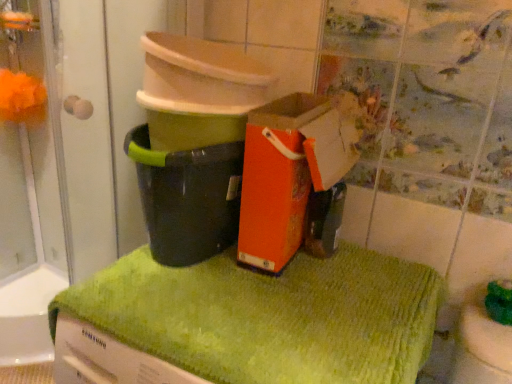
Image resolution: width=512 pixels, height=384 pixels. Identify the location of black plastic bucket at center. (187, 198).

Identify the location of orange paper bag at center. (290, 177).

This screenshot has width=512, height=384. Describe the element at coordinates (22, 98) in the screenshot. I see `orange fuzzy ball at upper left` at that location.

Where is `black plastic bucket at center`? The height and width of the screenshot is (384, 512). black plastic bucket at center is located at coordinates (187, 198).

Is green textured bath towel at center taller or shorter than orange paper bag at center?

In the image, green textured bath towel at center appears to be shorter than orange paper bag at center.

From a real-world perspective, is green textured bath towel at center physically above orange paper bag at center?

No.

Which is farther from the camera, (214, 264) or (331, 187)?

Positioned behind is point (214, 264).

Which object is closer to the camera, green textured bath towel at center or orange paper bag at center?

green textured bath towel at center is closer to the camera.

From their relative heights in the image, would you say orange paper bag at center is taller or shorter than green textured bath towel at center?

In the image, orange paper bag at center appears to be taller than green textured bath towel at center.

In the scene shown: Is orange paper bag at center facing away from green textured bath towel at center?

No.

From a real-world perspective, is orange paper bag at center beneath green textured bath towel at center?

Actually, orange paper bag at center is physically above green textured bath towel at center in the real world.

Which object is positioned more to the right, orange paper bag at center or green textured bath towel at center?

Positioned to the right is orange paper bag at center.

Does orange fuzzy ball at upper left have a greater width compared to black plastic bucket at center?

In fact, orange fuzzy ball at upper left might be narrower than black plastic bucket at center.

Is orange fuzzy ball at upper left surrounding black plastic bucket at center?

No, black plastic bucket at center is located outside of orange fuzzy ball at upper left.

Does orange fuzzy ball at upper left turn towards black plastic bucket at center?

No.

Based on their sizes in the image, would you say orange fuzzy ball at upper left is bigger or smaller than black plastic bucket at center?

Considering their sizes, orange fuzzy ball at upper left takes up less space than black plastic bucket at center.

From the picture: From a real-world perspective, who is located higher, orange fuzzy ball at upper left or green textured bath towel at center?

Answer: From a 3D spatial view, orange fuzzy ball at upper left is above.

Who is shorter, orange fuzzy ball at upper left or green textured bath towel at center?

Standing shorter between the two is orange fuzzy ball at upper left.

From the image's perspective, between orange fuzzy ball at upper left and green textured bath towel at center, who is located below?

green textured bath towel at center, from the image's perspective.

Does orange fuzzy ball at upper left touch green textured bath towel at center?

No.

From the image's perspective, between green textured bath towel at center and black plastic bucket at center, who is located below?

green textured bath towel at center.

Which of these two, green textured bath towel at center or black plastic bucket at center, is smaller?

Smaller between the two is black plastic bucket at center.

Locate an element on the screen. This screenshot has width=512, height=384. waste container above the green textured bath towel at center (from a real-world perspective) is located at coordinates (187, 198).

Can you confirm if black plastic bucket at center is positioned to the left of orange paper bag at center?

Yes.

From the image's perspective, is black plastic bucket at center located beneath orange paper bag at center?

Yes, from the image's perspective, black plastic bucket at center is below orange paper bag at center.

Is black plastic bucket at center oriented away from orange paper bag at center?

No, black plastic bucket at center is not facing the opposite direction of orange paper bag at center.

Does black plastic bucket at center have a greater height compared to orange paper bag at center?

Incorrect, the height of black plastic bucket at center is not larger of that of orange paper bag at center.

Is black plastic bucket at center thinner than green textured bath towel at center?

Yes, black plastic bucket at center is thinner than green textured bath towel at center.

What's the angular difference between black plastic bucket at center and green textured bath towel at center's facing directions?

The angular difference between black plastic bucket at center and green textured bath towel at center is 5.88 degrees.

Which of these two, black plastic bucket at center or green textured bath towel at center, is smaller?

black plastic bucket at center is smaller.

From a real-world perspective, which object stands above the other?

black plastic bucket at center, from a real-world perspective.

Find the location of a particular element. cardboard box above the green textured bath towel at center (from the image's perspective) is located at coordinates (290, 177).

At what (x,y) coordinates should I click in order to perform the action: click on cardboard box that appears on the right of green textured bath towel at center. Please return your answer as a coordinate pair (x, y). This screenshot has width=512, height=384. Looking at the image, I should click on (290, 177).

Which object lies nearer to the anchor point black plastic bucket at center, orange paper bag at center or orange fuzzy ball at upper left?

orange paper bag at center is closer to black plastic bucket at center.

Considering their positions, is green textured bath towel at center positioned closer to black plastic bucket at center than orange fuzzy ball at upper left?

green textured bath towel at center.

From the picture: Based on their spatial positions, is black plastic bucket at center or green textured bath towel at center further from orange fuzzy ball at upper left?

green textured bath towel at center is further to orange fuzzy ball at upper left.

Which object lies nearer to the anchor point orange fuzzy ball at upper left, orange paper bag at center or green textured bath towel at center?

orange paper bag at center.

Looking at the image, which one is located closer to orange paper bag at center, orange fuzzy ball at upper left or green textured bath towel at center?

Based on the image, green textured bath towel at center appears to be nearer to orange paper bag at center.

From the image, which object appears to be nearer to orange fuzzy ball at upper left, black plastic bucket at center or orange paper bag at center?

Among the two, black plastic bucket at center is located nearer to orange fuzzy ball at upper left.

When comparing their distances from green textured bath towel at center, does black plastic bucket at center or orange fuzzy ball at upper left seem further?

orange fuzzy ball at upper left is further to green textured bath towel at center.

From the image, which object appears to be nearer to green textured bath towel at center, orange paper bag at center or orange fuzzy ball at upper left?

Among the two, orange paper bag at center is located nearer to green textured bath towel at center.

You are a GUI agent. You are given a task and a screenshot of the screen. Output one action in this format:
    pyautogui.click(x=<x>, y=<y>)
    Task: Click on the waste container located between orange fuzzy ball at upper left and orange paper bag at center in the left-right direction
    
    Given the screenshot: What is the action you would take?
    pyautogui.click(x=187, y=198)

I want to click on waste container between orange fuzzy ball at upper left and green textured bath towel at center from left to right, so click(187, 198).

The image size is (512, 384). I want to click on bath towel located between orange fuzzy ball at upper left and orange paper bag at center in the left-right direction, so click(269, 316).

You are a GUI agent. You are given a task and a screenshot of the screen. Output one action in this format:
    pyautogui.click(x=<x>, y=<y>)
    Task: Click on the waste container between orange paper bag at center and green textured bath towel at center in the up-down direction
    The height and width of the screenshot is (384, 512).
    Given the screenshot: What is the action you would take?
    pyautogui.click(x=187, y=198)